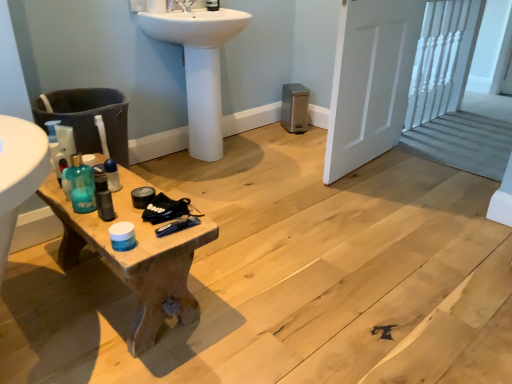
The height and width of the screenshot is (384, 512). Find the location of `vacant space in front of white glossy sink at upper center`. vacant space in front of white glossy sink at upper center is located at coordinates (223, 184).